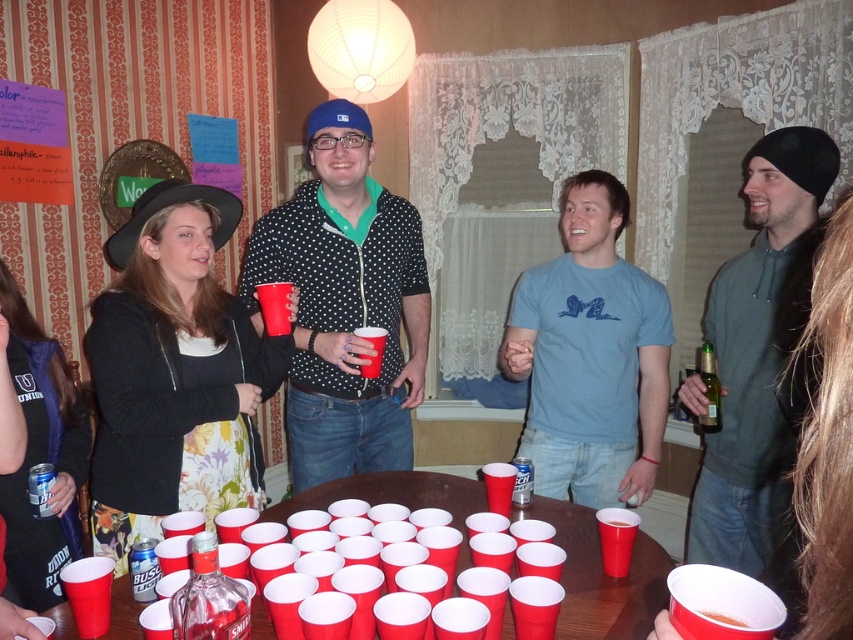
Is gray hoodie at right behind light blue cotton t-shirt at center?

No, it is not.

Between point (775, 436) and point (601, 209), which one is positioned in front?

Positioned in front is point (775, 436).

What are the coordinates of `gray hoodie at right` in the screenshot? It's located at (759, 358).

At what (x,y) coordinates should I click in order to perform the action: click on gray hoodie at right. Please return your answer as a coordinate pair (x, y). Looking at the image, I should click on (759, 358).

Is point (621, 620) positioned in front of point (190, 596)?

No, (621, 620) is behind (190, 596).

Who is positioned more to the left, smooth plastic cups at center or clear glass bottle at lower left?

clear glass bottle at lower left

Find the location of a particular element. The height and width of the screenshot is (640, 853). smooth plastic cups at center is located at coordinates (602, 577).

Which of these two, light blue cotton t-shirt at center or clear glass bottle at lower left, stands shorter?

clear glass bottle at lower left is shorter.

Does point (637, 316) lie in front of point (196, 593)?

No, it is behind (196, 593).

This screenshot has width=853, height=640. Identify the location of light blue cotton t-shirt at center. (590, 355).